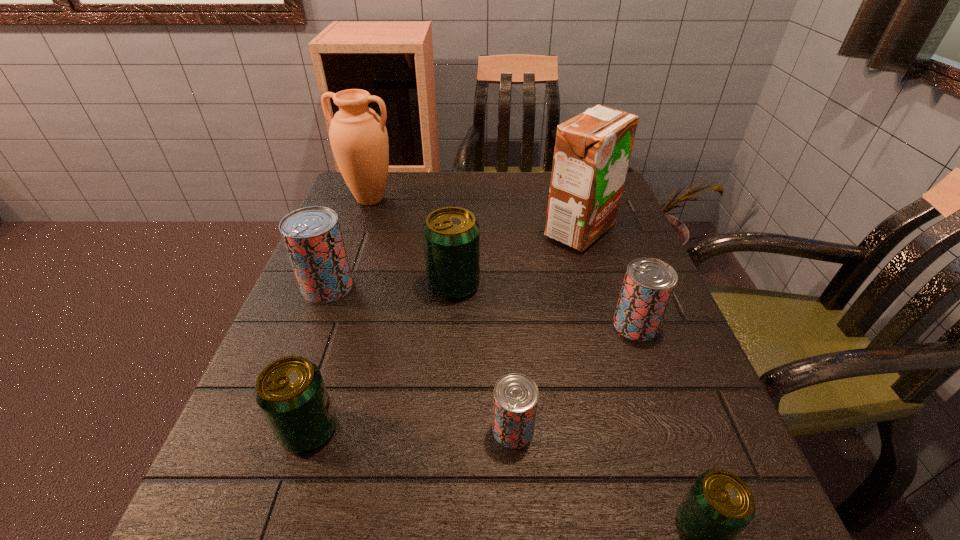
Where is `vacant point located 0.260m on the left of the nearest red beer can`? The height and width of the screenshot is (540, 960). vacant point located 0.260m on the left of the nearest red beer can is located at coordinates (324, 430).

At what (x,y) coordinates should I click in order to perform the action: click on urn located in the far edge section of the desktop. Please return your answer as a coordinate pair (x, y). The height and width of the screenshot is (540, 960). Looking at the image, I should click on (358, 136).

At what (x,y) coordinates should I click in order to perform the action: click on carton that is at the far edge. Please return your answer as a coordinate pair (x, y). Looking at the image, I should click on (592, 151).

Identify the location of urn located in the left edge section of the desktop. The height and width of the screenshot is (540, 960). (358, 136).

Where is `carton positioned at the right edge`? The width and height of the screenshot is (960, 540). carton positioned at the right edge is located at coordinates (592, 151).

The image size is (960, 540). I want to click on beer can that is at the right edge, so click(x=648, y=285).

The image size is (960, 540). Identify the location of object that is positioned at the far left corner. (358, 136).

Locate an element on the screen. The image size is (960, 540). object that is at the far right corner is located at coordinates coord(592,151).

Find the location of a particular element. free space at the far edge is located at coordinates (508, 184).

In the image, there is a desktop. At what (x,y) coordinates should I click in order to perform the action: click on vacant area at the left edge. Please return your answer as a coordinate pair (x, y). This screenshot has width=960, height=540. Looking at the image, I should click on (220, 480).